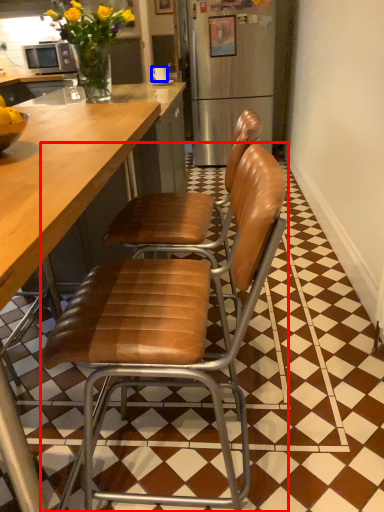
Question: Which point is closer to the camera, chair (highlighted by a red box) or coffee cup (highlighted by a blue box)?

Choices:
 (A) chair
 (B) coffee cup

Answer: (A)